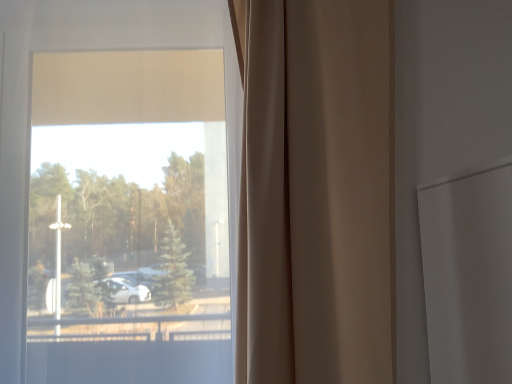
Question: Based on their positions, is beige fabric curtain at center located to the left or right of transparent glass window at center?

Choices:
 (A) left
 (B) right

Answer: (B)

Question: Considering their positions, is beige fabric curtain at center located in front of or behind transparent glass window at center?

Choices:
 (A) behind
 (B) front

Answer: (B)

Question: Is beige fabric curtain at center wider or thinner than transparent glass window at center?

Choices:
 (A) wide
 (B) thin

Answer: (B)

Question: Looking at the image, does transparent glass window at center seem bigger or smaller compared to beige fabric curtain at center?

Choices:
 (A) small
 (B) big

Answer: (B)

Question: From a real-world perspective, is transparent glass window at center above or below beige fabric curtain at center?

Choices:
 (A) below
 (B) above

Answer: (B)

Question: Looking at their shapes, would you say transparent glass window at center is wider or thinner than beige fabric curtain at center?

Choices:
 (A) thin
 (B) wide

Answer: (B)

Question: In the image, is transparent glass window at center on the left side or the right side of beige fabric curtain at center?

Choices:
 (A) right
 (B) left

Answer: (B)